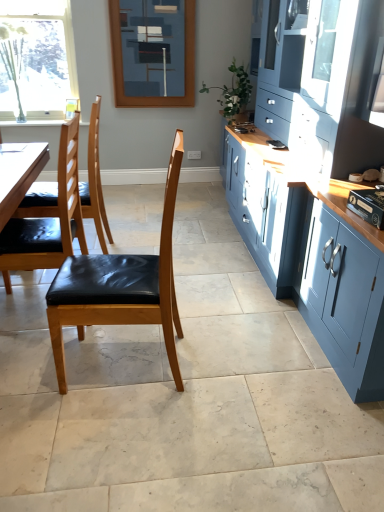
Where is `free space to the right of matte wood chair at left, which is the first chair from front to back`? The image size is (384, 512). free space to the right of matte wood chair at left, which is the first chair from front to back is located at coordinates tap(216, 366).